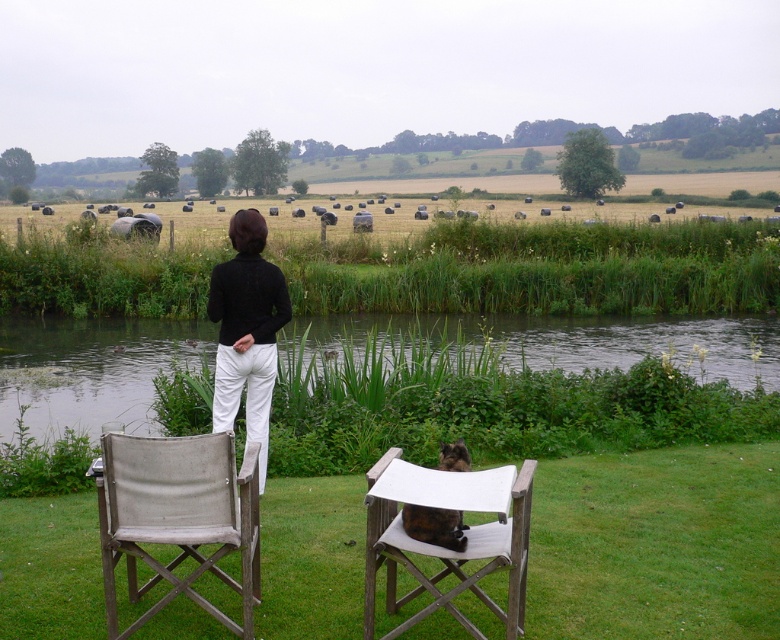
Is clear water at center smaller than brown furry cat at center?

Actually, clear water at center might be larger than brown furry cat at center.

Is clear water at center behind brown furry cat at center?

Yes.

Is point (73, 349) closer to camera compared to point (435, 531)?

No, it is not.

Where is `clear water at center`? This screenshot has width=780, height=640. clear water at center is located at coordinates (90, 369).

This screenshot has height=640, width=780. Describe the element at coordinates (90, 369) in the screenshot. I see `clear water at center` at that location.

Is point (90, 378) positioned in front of point (263, 460)?

No, (90, 378) is behind (263, 460).

This screenshot has width=780, height=640. Describe the element at coordinates (90, 369) in the screenshot. I see `clear water at center` at that location.

This screenshot has width=780, height=640. I want to click on clear water at center, so click(x=90, y=369).

Can you confirm if black matte pants at center is taller than brown furry cat at center?

Indeed, black matte pants at center has a greater height compared to brown furry cat at center.

Is point (229, 352) in front of point (438, 538)?

No, it is not.

This screenshot has width=780, height=640. I want to click on black matte pants at center, so click(246, 330).